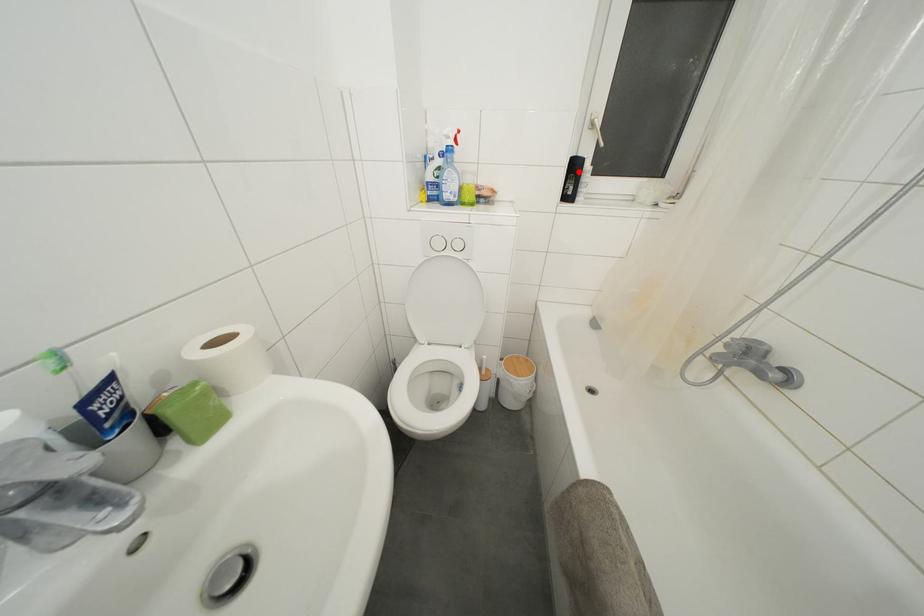
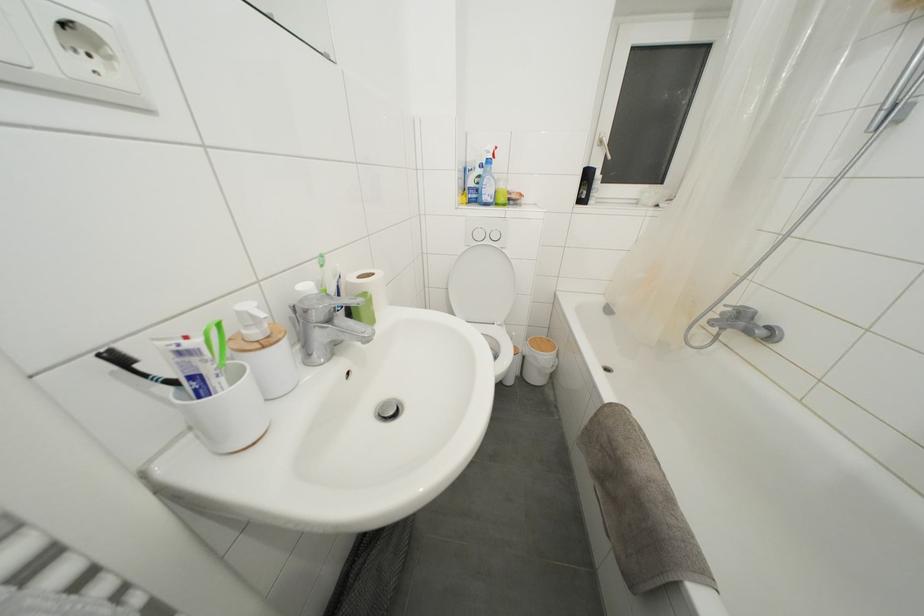
The point at the highlighted location is marked in the first image. Where is the corresponding point in the second image?

(591, 180)